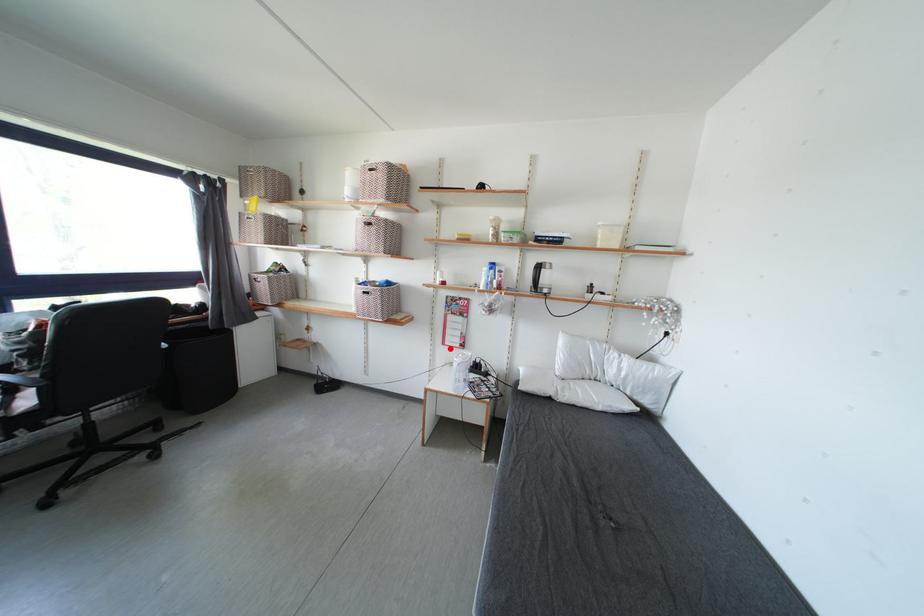
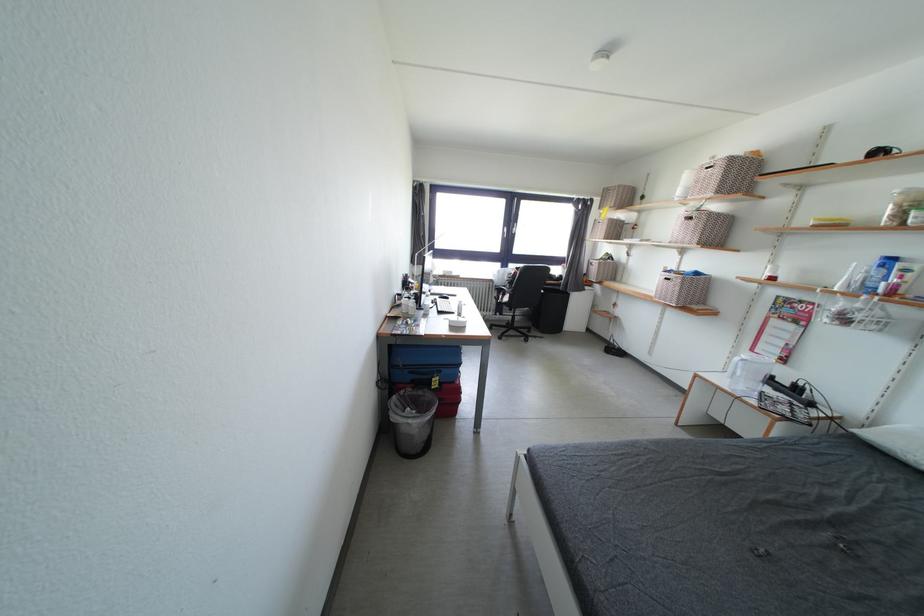
Locate, in the second image, the point that corresponds to the highlighted location in the first image.

(759, 355)